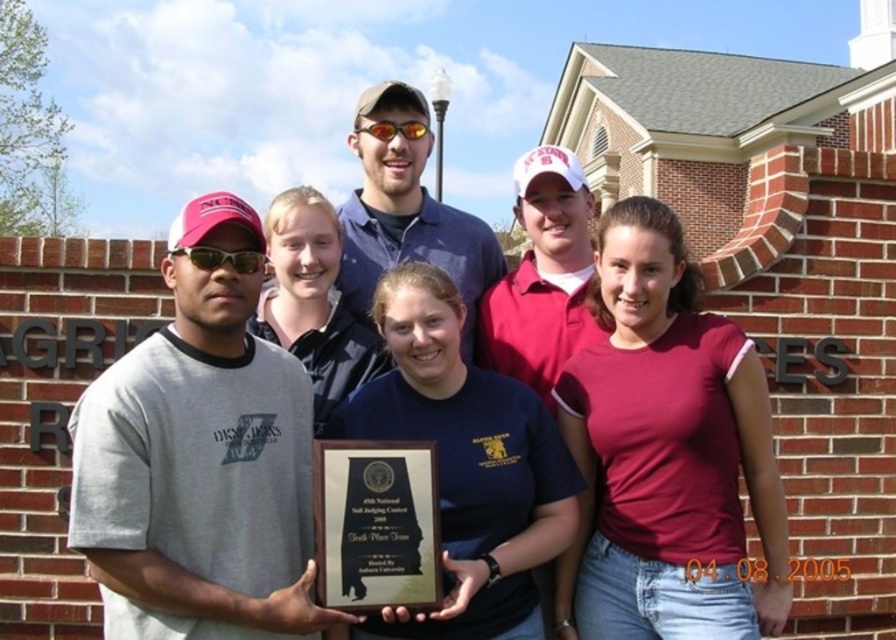
You are a photographer trying to frame a shot of the blue denim shirt at center and the sunglasses at left. Which object should you zoom in on to capture both without cropping either?

The blue denim shirt at center is wider than the sunglasses at left, so you should zoom in on the sunglasses at left to ensure both fit within the frame without cropping.